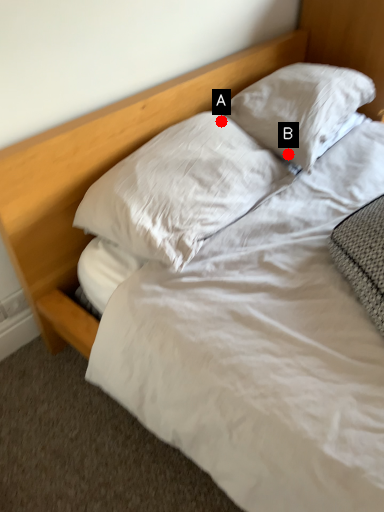
Question: Two points are circled on the image, labeled by A and B beside each circle. Which point is farther to the camera?

Choices:
 (A) A is further
 (B) B is further

Answer: (B)